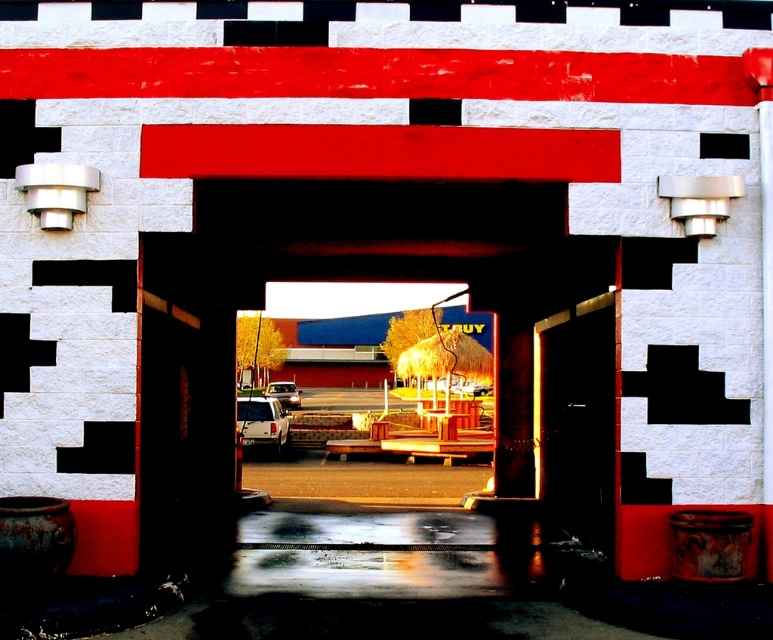
You are a delivery person trying to drive a truck through the wooden door at center. The truck has a black rubber tire at center that is 2 meters wide. Can the truck pass through the door without any modifications?

The wooden door at center has a lesser width compared to black rubber tire at center, meaning the door is narrower than the truck tire. Therefore, the truck cannot pass through the door without modifications.